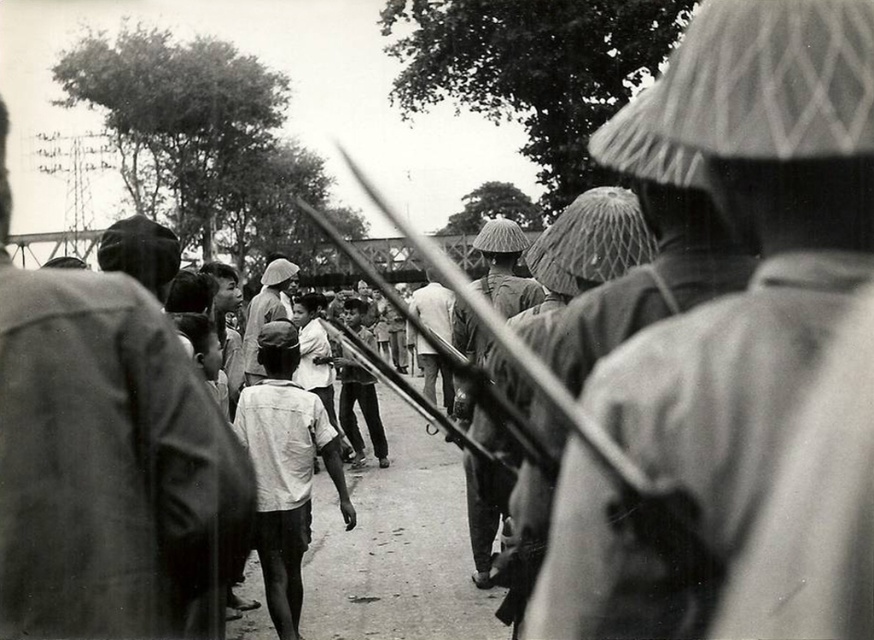
Question: Which point is farther to the camera?

Choices:
 (A) white cotton shirt at center
 (B) textured straw hat at center

Answer: (A)

Question: Is textured straw hat at center thinner than white cotton shirt at center?

Choices:
 (A) no
 (B) yes

Answer: (B)

Question: Can you confirm if textured straw hat at center is positioned to the right of white cotton shirt at center?

Choices:
 (A) yes
 (B) no

Answer: (A)

Question: Does textured straw hat at center appear over white cotton shirt at center?

Choices:
 (A) no
 (B) yes

Answer: (B)

Question: Which object appears farthest from the camera in this image?

Choices:
 (A) textured straw hat at center
 (B) dark gray cloth jacket at left
 (C) white cotton shirt at center

Answer: (C)

Question: Which point is closer to the camera?

Choices:
 (A) white cotton shirt at center
 (B) dark gray cloth jacket at left
 (C) textured straw hat at center

Answer: (C)